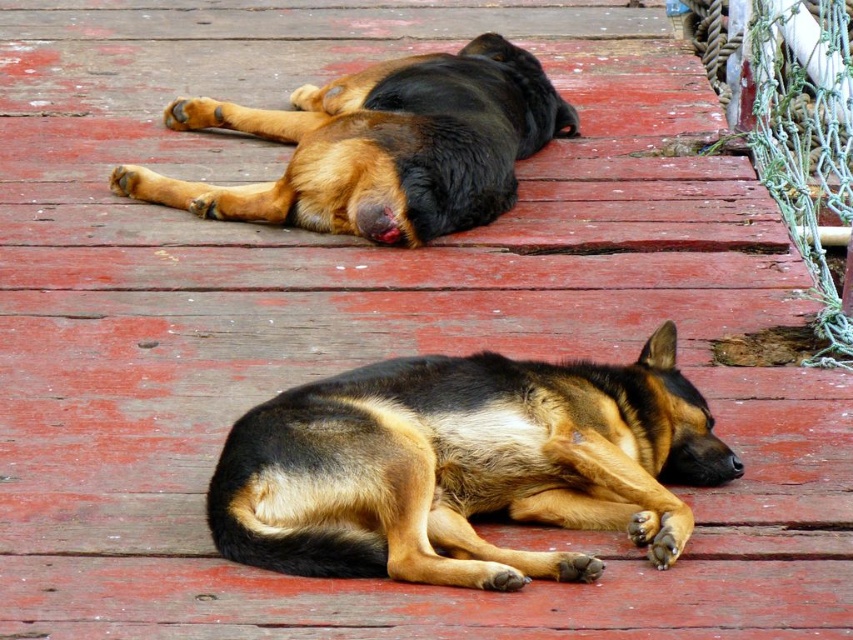
Question: Where is black and tan fur dog at center located in relation to brown-black fur dog at upper center in the image?

Choices:
 (A) left
 (B) right

Answer: (B)

Question: Can you confirm if black and tan fur dog at center is thinner than brown-black fur dog at upper center?

Choices:
 (A) yes
 (B) no

Answer: (A)

Question: Is black and tan fur dog at center to the right of brown-black fur dog at upper center from the viewer's perspective?

Choices:
 (A) yes
 (B) no

Answer: (A)

Question: Among these objects, which one is nearest to the camera?

Choices:
 (A) black and tan fur dog at center
 (B) brown-black fur dog at upper center

Answer: (A)

Question: Which point is closer to the camera?

Choices:
 (A) (352, 125)
 (B) (210, 488)

Answer: (B)